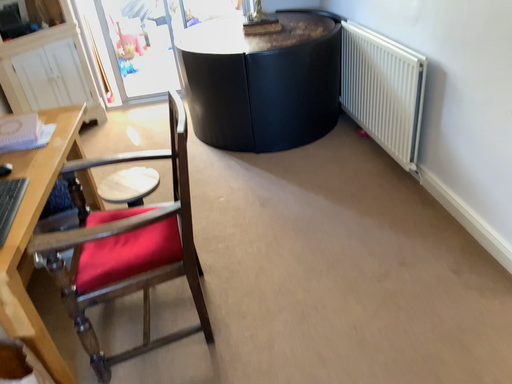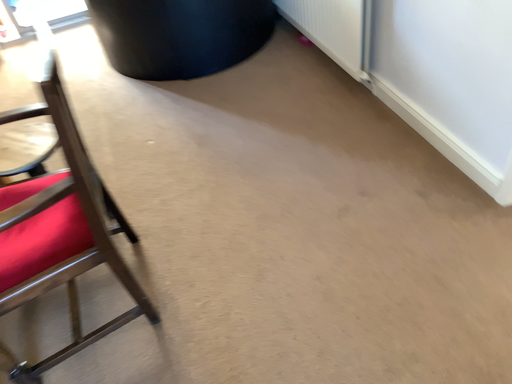
Question: Which way did the camera rotate in the video?

Choices:
 (A) rotated right
 (B) rotated left

Answer: (A)